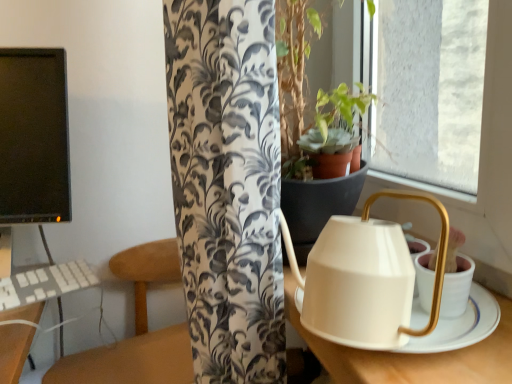
In order to face white matte kettle at right, should I rotate leftwards or rightwards?

To align with it, rotate right about 11.914°.

What do you see at coordinates (412, 354) in the screenshot? This screenshot has width=512, height=384. I see `white matte kettle at right` at bounding box center [412, 354].

Identify the location of wooden table at center. The image size is (512, 384). (412, 355).

How many degrees apart are the facing directions of wooden table at center and white matte kettle at right?

The facing directions of wooden table at center and white matte kettle at right are 83.6 degrees apart.

Looking at this image, from the image's perspective, which is above, wooden table at center or white matte kettle at right?

From the image's view, white matte kettle at right is above.

Is wooden table at center directly adjacent to white matte kettle at right?

No, wooden table at center is not next to white matte kettle at right.

Who is shorter, wooden table at center or white matte kettle at right?

white matte kettle at right is shorter.

Who is bigger, black matte monitor at left or wooden table at center?

Bigger between the two is wooden table at center.

Considering the sizes of black matte monitor at left and wooden table at center in the image, is black matte monitor at left wider or thinner than wooden table at center?

In the image, black matte monitor at left appears to be more narrow than wooden table at center.

Are black matte monitor at left and wooden table at center far apart?

They are positioned close to each other.

Can we say black matte monitor at left lies outside wooden table at center?

Yes.

Does black matte monitor at left touch white plastic keyboard at lower left?

No, black matte monitor at left is not with white plastic keyboard at lower left.

Locate an element on the screen. The height and width of the screenshot is (384, 512). keyboard that appears below the black matte monitor at left (from the image's perspective) is located at coordinates click(45, 283).

Is black matte monitor at left behind white plastic keyboard at lower left?

Yes, it is.

Looking at their sizes, would you say wooden table at center is wider or thinner than black matte monitor at left?

Clearly, wooden table at center has more width compared to black matte monitor at left.

Does wooden table at center turn towards black matte monitor at left?

No, wooden table at center is not oriented towards black matte monitor at left.

Looking at this image, which is closer to the camera, (502,303) or (62,293)?

Point (502,303) is positioned closer to the camera compared to point (62,293).

In the scene shown: Would you say wooden table at center is a long distance from black matte monitor at left?

wooden table at center is near black matte monitor at left, not far away.

From a real-world perspective, which object stands above the other?

In real-world perspective, black matte monitor at left is above.

Considering the relative positions of white plastic keyboard at lower left and black matte monitor at left in the image provided, is white plastic keyboard at lower left to the left of black matte monitor at left from the viewer's perspective?

Yes, white plastic keyboard at lower left is to the left of black matte monitor at left.

Looking at this image, from the image's perspective, which one is positioned higher, white plastic keyboard at lower left or black matte monitor at left?

black matte monitor at left appears higher in the image.

Is white plastic keyboard at lower left looking in the opposite direction of black matte monitor at left?

Yes, white plastic keyboard at lower left is facing away from black matte monitor at left.

From the image's perspective, is white plastic keyboard at lower left on white matte kettle at right?

Actually, white plastic keyboard at lower left appears below white matte kettle at right in the image.

Who is taller, white plastic keyboard at lower left or white matte kettle at right?

With more height is white matte kettle at right.

Between white plastic keyboard at lower left and white matte kettle at right, which one has smaller width?

Thinner between the two is white plastic keyboard at lower left.

Are white plastic keyboard at lower left and white matte kettle at right beside each other?

No, white plastic keyboard at lower left is not making contact with white matte kettle at right.

From a real-world perspective, between white plastic keyboard at lower left and wooden table at center, who is vertically higher?

white plastic keyboard at lower left is physically above.

Is wooden table at center completely or partially inside white plastic keyboard at lower left?

Definitely not — wooden table at center is not inside white plastic keyboard at lower left.

Can you tell me how much white plastic keyboard at lower left and wooden table at center differ in facing direction?

There is a 27.8-degree angle between the facing directions of white plastic keyboard at lower left and wooden table at center.

Considering the points (72, 276) and (456, 365), which point is in front, point (72, 276) or point (456, 365)?

Positioned in front is point (456, 365).

I want to click on table on the left of white matte kettle at right, so click(412, 355).

This screenshot has width=512, height=384. In order to click on table that is on the right side of black matte monitor at left in this screenshot , I will do `click(412, 355)`.

From the image, which object appears to be nearer to wooden table at center, black matte monitor at left or white matte kettle at right?

black matte monitor at left lies closer to wooden table at center than the other object.

Looking at this image, based on their spatial positions, is white plastic keyboard at lower left or black matte monitor at left closer to wooden table at center?

white plastic keyboard at lower left is closer to wooden table at center.

Looking at the image, which one is located further to white plastic keyboard at lower left, black matte monitor at left or wooden table at center?

Among the two, wooden table at center is located further to white plastic keyboard at lower left.

From the image, which object appears to be farther from white plastic keyboard at lower left, white matte kettle at right or wooden table at center?

white matte kettle at right is further to white plastic keyboard at lower left.

Based on their spatial positions, is white matte kettle at right or black matte monitor at left closer to white plastic keyboard at lower left?

black matte monitor at left.

Estimate the real-world distances between objects in this image. Which object is further from black matte monitor at left, wooden table at center or white matte kettle at right?

white matte kettle at right.

Based on their spatial positions, is wooden table at center or white plastic keyboard at lower left further from white matte kettle at right?

Among the two, white plastic keyboard at lower left is located further to white matte kettle at right.

Estimate the real-world distances between objects in this image. Which object is further from white plastic keyboard at lower left, black matte monitor at left or white matte kettle at right?

white matte kettle at right is further to white plastic keyboard at lower left.

Identify the location of table between white plastic keyboard at lower left and white matte kettle at right from left to right. The height and width of the screenshot is (384, 512). (412, 355).

The width and height of the screenshot is (512, 384). I want to click on keyboard between black matte monitor at left and wooden table at center in the up-down direction, so click(x=45, y=283).

Find the location of `table between black matte monitor at left and white matte kettle at right`. table between black matte monitor at left and white matte kettle at right is located at coordinates (412, 355).

The image size is (512, 384). I want to click on desktop computer situated between white plastic keyboard at lower left and white matte kettle at right from left to right, so click(x=34, y=138).